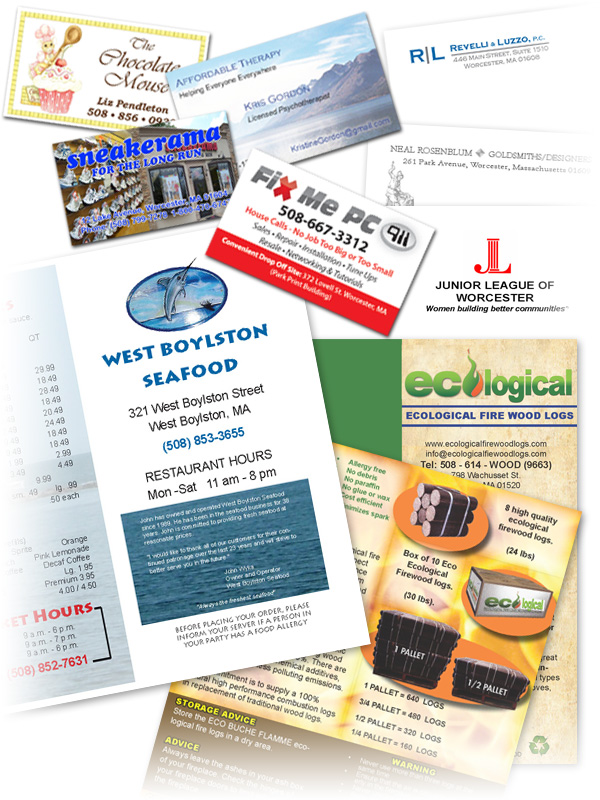
Locate an element on the screen. pc is located at coordinates (359, 214).